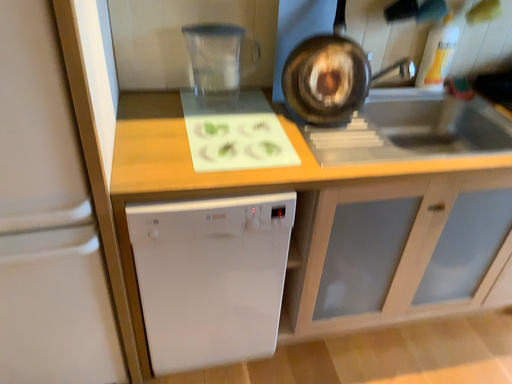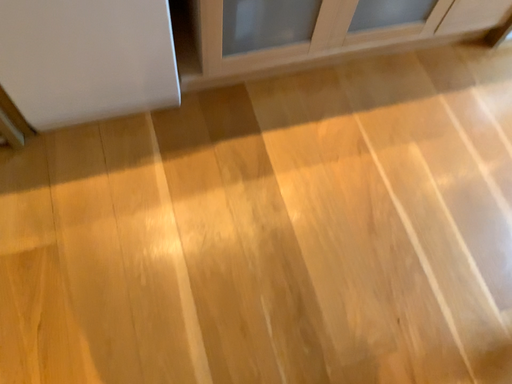
Question: How did the camera likely rotate when shooting the video?

Choices:
 (A) rotated downward
 (B) rotated upward

Answer: (A)